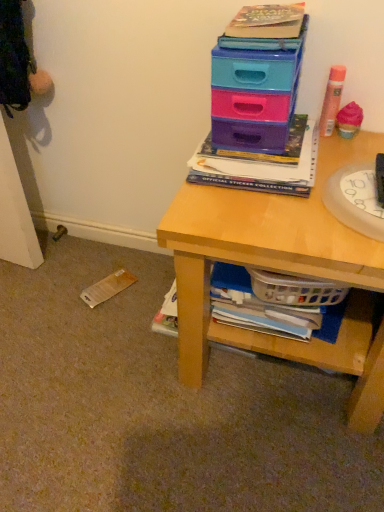
Locate an element on the screen. vacant area that is in front of wooden desk at upper right is located at coordinates (251, 460).